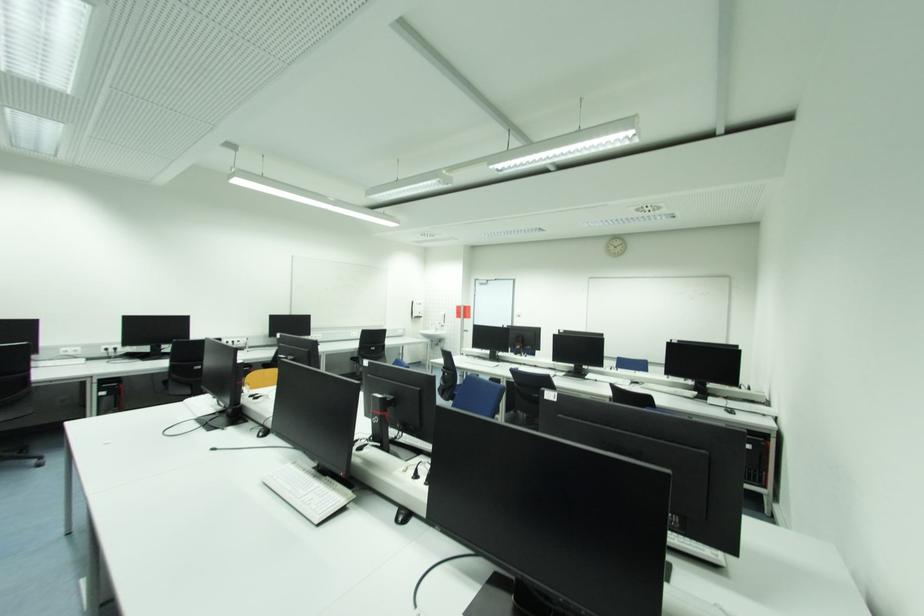
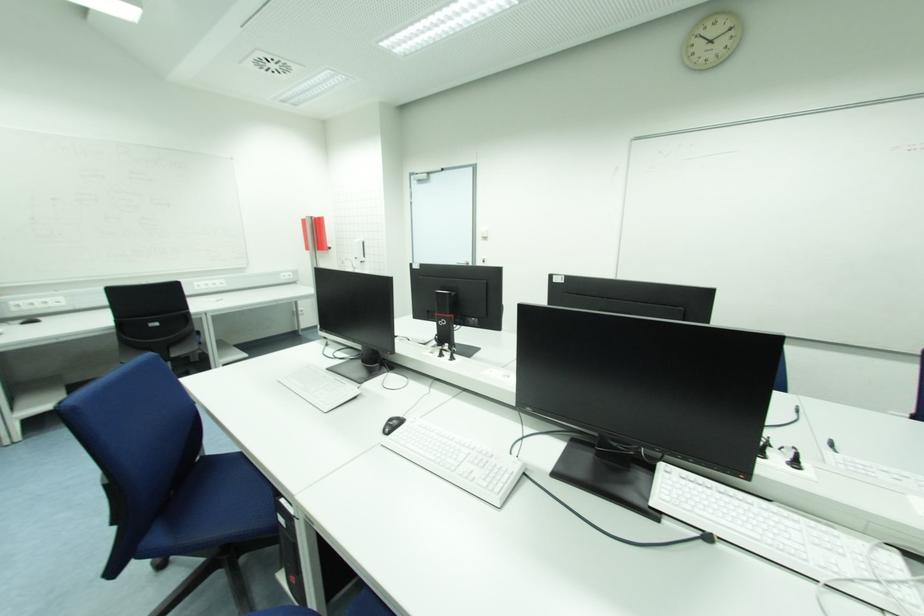
Question: In a continuous first-person perspective shot, in which direction is the camera moving?

Choices:
 (A) Left
 (B) Right
 (C) Forward
 (D) Backward

Answer: (C)